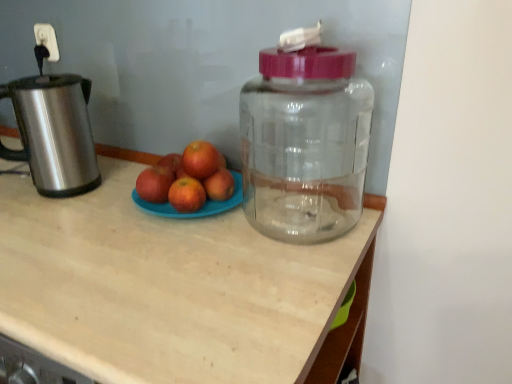
Describe the element at coordinates (54, 131) in the screenshot. I see `brushed metal kettle at left` at that location.

What do you see at coordinates (154, 184) in the screenshot? The width and height of the screenshot is (512, 384). I see `red matte apple at center, which ranks as the second apple in right-to-left order` at bounding box center [154, 184].

The height and width of the screenshot is (384, 512). What do you see at coordinates (305, 144) in the screenshot?
I see `transparent plastic bottle at center` at bounding box center [305, 144].

Find the location of a particular element. matte plastic plate of apples at center is located at coordinates (175, 289).

At what (x,y) coordinates should I click in order to perform the action: click on red matte grapefruit at center, which is the second grapefruit from top to bottom. Please return your answer as a coordinate pair (x, y). Looking at the image, I should click on (186, 195).

From the picture: Can you confirm if red matte apple at center, which ranks as the 1th apple in right-to-left order, is positioned to the left of transparent plastic bottle at center?

Indeed, red matte apple at center, which ranks as the 1th apple in right-to-left order, is positioned on the left side of transparent plastic bottle at center.

Where is `bottle above the red matte apple at center, acting as the second apple starting from the left (from the image's perspective)`? Image resolution: width=512 pixels, height=384 pixels. bottle above the red matte apple at center, acting as the second apple starting from the left (from the image's perspective) is located at coordinates coord(305,144).

Based on the photo, can you confirm if red matte apple at center, which ranks as the 1th apple in right-to-left order, is thinner than transparent plastic bottle at center?

Yes.

Who is bigger, red matte grapefruit at center, the first grapefruit when ordered from bottom to top, or red matte apple at center, which ranks as the 1th apple in right-to-left order?

With larger size is red matte apple at center, which ranks as the 1th apple in right-to-left order.

Is point (189, 180) in front of point (226, 169)?

That is True.

Could you tell me if red matte grapefruit at center, the first grapefruit when ordered from bottom to top, is turned towards red matte apple at center, acting as the second apple starting from the left?

No, red matte grapefruit at center, the first grapefruit when ordered from bottom to top, is not turned towards red matte apple at center, acting as the second apple starting from the left.

Is red matte grapefruit at center, the first grapefruit when ordered from bottom to top, wider than red matte apple at center, acting as the second apple starting from the left?

No.

From the image's perspective, between brushed metal kettle at left and red matte apple at center, which ranks as the 1th apple in right-to-left order, which one is located above?

brushed metal kettle at left is shown above in the image.

In terms of width, does brushed metal kettle at left look wider or thinner when compared to red matte apple at center, acting as the second apple starting from the left?

Clearly, brushed metal kettle at left has more width compared to red matte apple at center, acting as the second apple starting from the left.

Is brushed metal kettle at left facing towards red matte apple at center, acting as the second apple starting from the left?

No, brushed metal kettle at left does not turn towards red matte apple at center, acting as the second apple starting from the left.

Is brushed metal kettle at left smaller than red matte apple at center, acting as the second apple starting from the left?

Incorrect, brushed metal kettle at left is not smaller in size than red matte apple at center, acting as the second apple starting from the left.

Could you measure the distance between matte plastic plate of apples at center and red matte apple at center, acting as the second apple starting from the left?

matte plastic plate of apples at center is 11.55 inches from red matte apple at center, acting as the second apple starting from the left.

Is matte plastic plate of apples at center not inside red matte apple at center, which ranks as the 1th apple in right-to-left order?

Indeed, matte plastic plate of apples at center is completely outside red matte apple at center, which ranks as the 1th apple in right-to-left order.

Considering the relative sizes of matte plastic plate of apples at center and red matte apple at center, acting as the second apple starting from the left, in the image provided, is matte plastic plate of apples at center shorter than red matte apple at center, acting as the second apple starting from the left,?

In fact, matte plastic plate of apples at center may be taller than red matte apple at center, acting as the second apple starting from the left.

From the image's perspective, between matte plastic plate of apples at center and red matte apple at center, acting as the second apple starting from the left, which one is located above?

red matte apple at center, acting as the second apple starting from the left.

From the image's perspective, is matte plastic plate of apples at center below brushed metal kettle at left?

Indeed, from the image's perspective, matte plastic plate of apples at center is shown beneath brushed metal kettle at left.

Is brushed metal kettle at left surrounded by matte plastic plate of apples at center?

No, brushed metal kettle at left is not surrounded by matte plastic plate of apples at center.

Is point (274, 342) closer to viewer compared to point (19, 94)?

Yes.

From the picture: Can you tell me how much matte plastic plate of apples at center and brushed metal kettle at left differ in facing direction?

The angle between the facing direction of matte plastic plate of apples at center and the facing direction of brushed metal kettle at left is 39 degrees.

How different are the orientations of red matte apple at center, which ranks as the 1th apple in right-to-left order, and matte plastic plate of apples at center in degrees?

They differ by 0.362 degrees in their facing directions.

Where is `desk that appears below the red matte apple at center, which ranks as the 1th apple in right-to-left order (from the image's perspective)`? The image size is (512, 384). desk that appears below the red matte apple at center, which ranks as the 1th apple in right-to-left order (from the image's perspective) is located at coordinates (175, 289).

Which is further, (205, 185) or (84, 319)?

Positioned behind is point (205, 185).

Is red matte apple at center, which ranks as the 1th apple in right-to-left order, bigger than matte plastic plate of apples at center?

Incorrect, red matte apple at center, which ranks as the 1th apple in right-to-left order, is not larger than matte plastic plate of apples at center.

This screenshot has height=384, width=512. Identify the location of apple below the red matte apple at center, the first apple viewed from the left (from a real-world perspective). (219, 185).

Would you say red matte apple at center, acting as the second apple starting from the left, is inside or outside red matte apple at center, which ranks as the second apple in right-to-left order?

red matte apple at center, acting as the second apple starting from the left, is not enclosed by red matte apple at center, which ranks as the second apple in right-to-left order.

Does red matte apple at center, which ranks as the 1th apple in right-to-left order, appear on the right side of red matte apple at center, the first apple viewed from the left?

Correct, you'll find red matte apple at center, which ranks as the 1th apple in right-to-left order, to the right of red matte apple at center, the first apple viewed from the left.

How many degrees apart are the facing directions of red matte apple at center, which ranks as the 1th apple in right-to-left order, and red matte apple at center, which ranks as the second apple in right-to-left order?

They differ by 0.000961 degrees in their facing directions.

From the image's perspective, which apple is the 2nd one below the transparent plastic bottle at center? Please provide its 2D coordinates.

[(219, 185)]

This screenshot has height=384, width=512. There is a red matte grapefruit at center, which is the second grapefruit from top to bottom. Find the location of `the 1st apple above it (from the image's perspective)`. the 1st apple above it (from the image's perspective) is located at coordinates pos(219,185).

From the image, which object appears to be nearer to brushed metal kettle at left, red matte grapefruit at center, which appears as the 1th grapefruit when viewed from the top, or red matte apple at center, the first apple viewed from the left?

Based on the image, red matte apple at center, the first apple viewed from the left, appears to be nearer to brushed metal kettle at left.

When comparing their distances from red matte apple at center, the first apple viewed from the left, does transparent plastic bottle at center or brushed metal kettle at left seem closer?

brushed metal kettle at left is positioned closer to the anchor red matte apple at center, the first apple viewed from the left.

Which object lies further to the anchor point red matte grapefruit at center, the first grapefruit when ordered from bottom to top, red matte apple at center, the first apple viewed from the left, or brushed metal kettle at left?

brushed metal kettle at left.

In the scene shown: Which object lies nearer to the anchor point red matte apple at center, acting as the second apple starting from the left, red matte grapefruit at center, which is the second grapefruit from top to bottom, or matte plastic plate of apples at center?

Among the two, red matte grapefruit at center, which is the second grapefruit from top to bottom, is located nearer to red matte apple at center, acting as the second apple starting from the left.

Considering their positions, is red matte grapefruit at center, which is the second grapefruit from top to bottom, positioned closer to red matte grapefruit at center, which ranks as the second grapefruit in bottom-to-top order, than transparent plastic bottle at center?

Among the two, red matte grapefruit at center, which is the second grapefruit from top to bottom, is located nearer to red matte grapefruit at center, which ranks as the second grapefruit in bottom-to-top order.

Considering their positions, is transparent plastic bottle at center positioned further to red matte apple at center, which ranks as the 1th apple in right-to-left order, than red matte apple at center, which ranks as the second apple in right-to-left order?

transparent plastic bottle at center is further to red matte apple at center, which ranks as the 1th apple in right-to-left order.

Considering their positions, is red matte grapefruit at center, which appears as the 1th grapefruit when viewed from the top, positioned further to red matte apple at center, the first apple viewed from the left, than matte plastic plate of apples at center?

matte plastic plate of apples at center is positioned further to the anchor red matte apple at center, the first apple viewed from the left.

Looking at the image, which one is located further to brushed metal kettle at left, red matte apple at center, which ranks as the second apple in right-to-left order, or red matte grapefruit at center, which ranks as the second grapefruit in bottom-to-top order?

red matte grapefruit at center, which ranks as the second grapefruit in bottom-to-top order, lies further to brushed metal kettle at left than the other object.

I want to click on grapefruit between brushed metal kettle at left and red matte grapefruit at center, which ranks as the second grapefruit in bottom-to-top order, in the horizontal direction, so click(186, 195).

Identify the location of grapefruit between red matte grapefruit at center, which ranks as the second grapefruit in bottom-to-top order, and matte plastic plate of apples at center vertically. (186, 195).

What are the coordinates of `grapefruit between transparent plastic bottle at center and red matte grapefruit at center, which appears as the 1th grapefruit when viewed from the top, in the front-back direction` in the screenshot? It's located at (186, 195).

You are a GUI agent. You are given a task and a screenshot of the screen. Output one action in this format:
    pyautogui.click(x=<x>, y=<y>)
    Task: Click on the grapefruit between red matte apple at center, which ranks as the second apple in right-to-left order, and red matte grapefruit at center, which ranks as the second grapefruit in bottom-to-top order
    
    Given the screenshot: What is the action you would take?
    pyautogui.click(x=186, y=195)